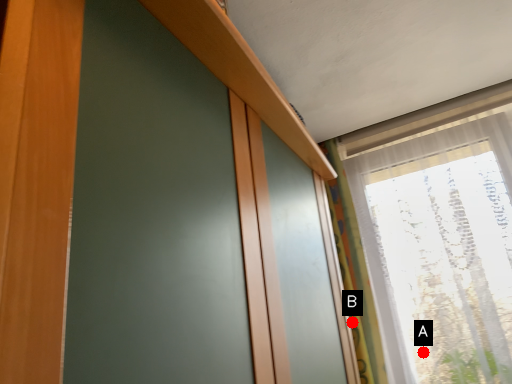
Question: Two points are circled on the image, labeled by A and B beside each circle. Among these points, which one is nearest to the camera?

Choices:
 (A) A is closer
 (B) B is closer

Answer: (A)